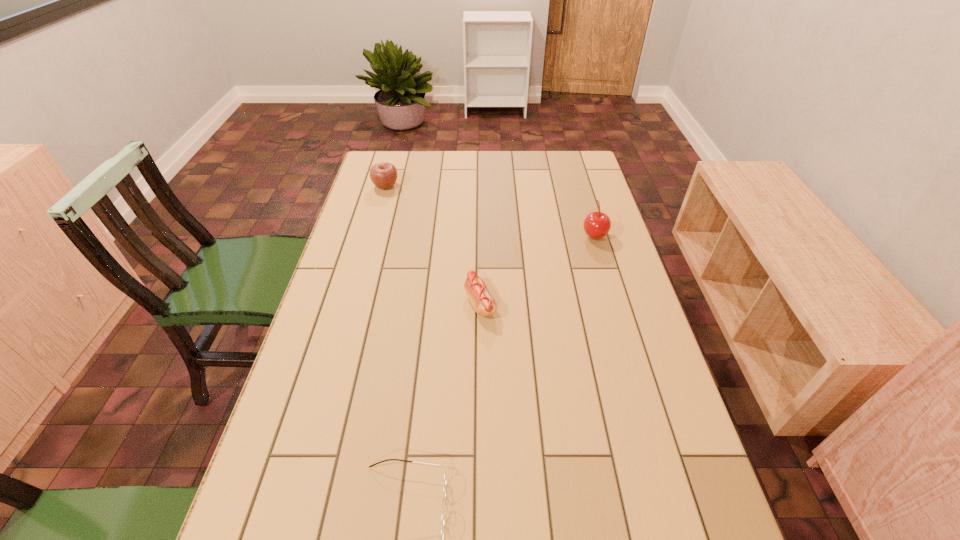
Find the location of a particular element. The height and width of the screenshot is (540, 960). the tallest object is located at coordinates (596, 225).

This screenshot has width=960, height=540. Identify the location of cherry. (596, 225).

Locate an element on the screen. The width and height of the screenshot is (960, 540). the farthest object is located at coordinates (383, 175).

I want to click on the leftmost object, so click(383, 175).

This screenshot has width=960, height=540. I want to click on the third tallest object, so click(x=484, y=304).

The image size is (960, 540). I want to click on the second nearest object, so click(484, 304).

At what (x,y) coordinates should I click in order to perform the action: click on vacant area situated 0.110m on the front of the tallest object. Please return your answer as a coordinate pair (x, y). Image resolution: width=960 pixels, height=540 pixels. Looking at the image, I should click on (604, 269).

At what (x,y) coordinates should I click in order to perform the action: click on vacant point located 0.230m on the side of the second tallest object with the unique marking. Please return your answer as a coordinate pair (x, y). Looking at the image, I should click on (461, 186).

Find the location of a particular element. The width and height of the screenshot is (960, 540). free space located on the back of the third farthest object is located at coordinates (480, 209).

Where is `object that is at the far edge`? The height and width of the screenshot is (540, 960). object that is at the far edge is located at coordinates (383, 175).